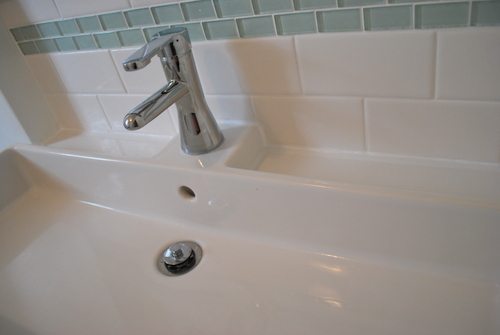
You are a GUI agent. You are given a task and a screenshot of the screen. Output one action in this format:
    pyautogui.click(x=<x>, y=<y>)
    Task: Click on the right of faucet handle
    
    Given the screenshot: What is the action you would take?
    [145, 56], [169, 41]